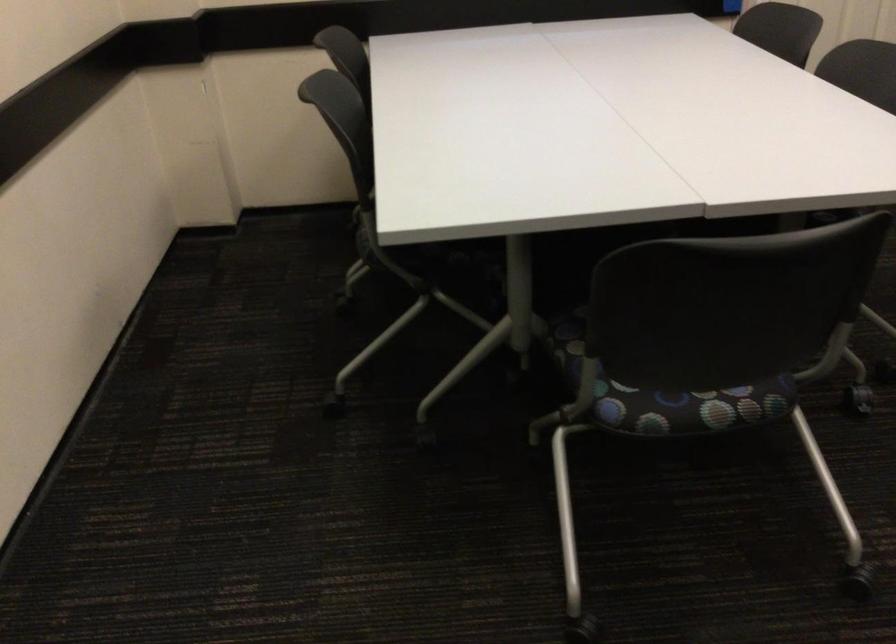
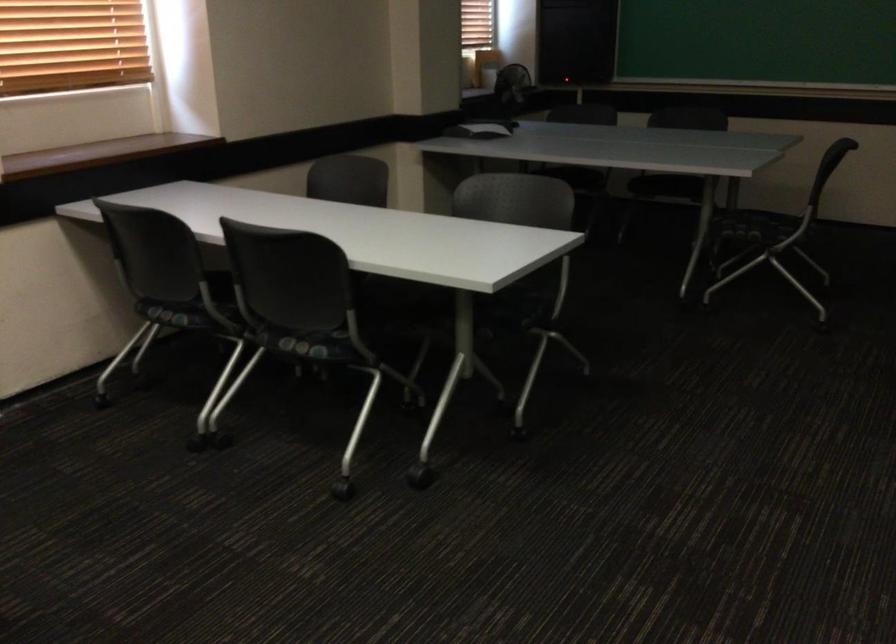
Question: The first image is from the beginning of the video and the second image is from the end. How did the camera likely rotate when shooting the video?

Choices:
 (A) Left
 (B) Right
 (C) Up
 (D) Down

Answer: (B)